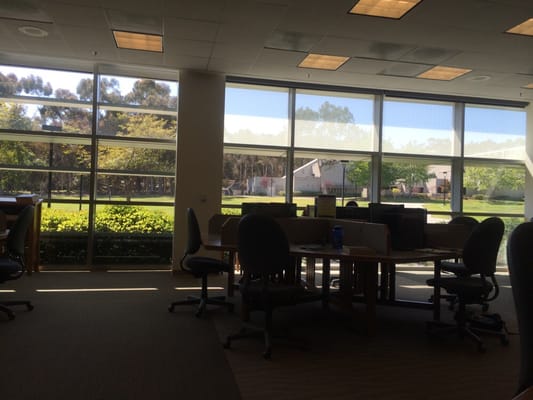
The width and height of the screenshot is (533, 400). Find the location of `tall wooden desk`. tall wooden desk is located at coordinates (33, 238).